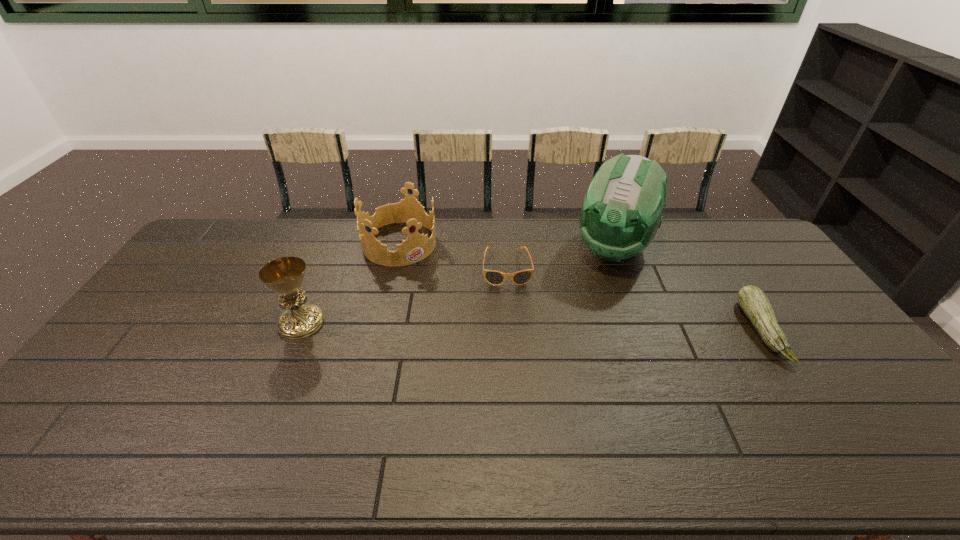
Locate an element on the screen. The image size is (960, 540). sunglasses present at the far edge is located at coordinates click(493, 277).

You are a GUI agent. You are given a task and a screenshot of the screen. Output one action in this format:
    pyautogui.click(x=<x>, y=<y>)
    Task: Click on the tiara that is positioned at the far edge
    The image size is (960, 540).
    Given the screenshot: What is the action you would take?
    tap(416, 247)

Find the location of a particular element. This screenshot has width=960, height=540. free space at the far edge of the desktop is located at coordinates (262, 233).

Find the location of a particular element. This screenshot has height=540, width=960. vacant space at the near edge is located at coordinates (770, 416).

The width and height of the screenshot is (960, 540). Find the location of `vacant space at the left edge of the desktop`. vacant space at the left edge of the desktop is located at coordinates (167, 295).

This screenshot has height=540, width=960. I want to click on vacant space at the right edge of the desktop, so pos(876,392).

At what (x,y) coordinates should I click in order to perform the action: click on vacant space that's between the zucchini and the third object from left to right. Please return your answer as a coordinate pair (x, y). Looking at the image, I should click on (634, 299).

The image size is (960, 540). What are the coordinates of `empty space between the leftmost object and the tallest object` in the screenshot? It's located at (457, 286).

Where is `empty location between the zucchini and the leftmost object`? The image size is (960, 540). empty location between the zucchini and the leftmost object is located at coordinates (531, 326).

This screenshot has height=540, width=960. I want to click on blank region between the chalice and the football helmet, so click(x=457, y=286).